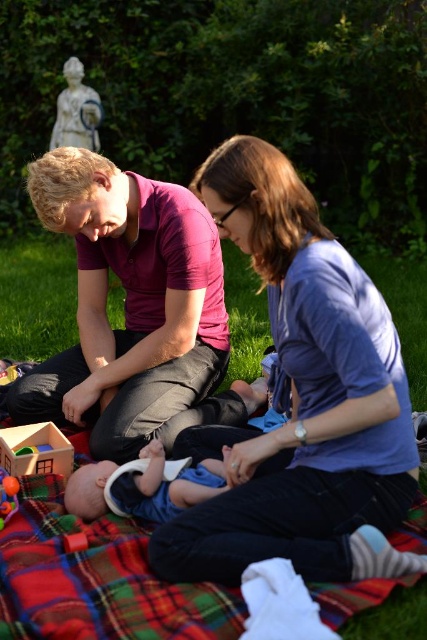
Is point (286, 445) more distant than point (8, 438)?

No, (286, 445) is in front of (8, 438).

Who is higher up, blue cotton shirt at center or wooden house at lower left?

blue cotton shirt at center is above.

This screenshot has width=427, height=640. Describe the element at coordinates (304, 397) in the screenshot. I see `blue cotton shirt at center` at that location.

Identify the location of blue cotton shirt at center. (304, 397).

Is white plastic bib at center to the left of wooden block at lower left from the viewer's perspective?

In fact, white plastic bib at center is to the right of wooden block at lower left.

Which of these two, white plastic bib at center or wooden block at lower left, stands shorter?

Standing shorter between the two is wooden block at lower left.

Describe the element at coordinates (143, 484) in the screenshot. Image resolution: width=427 pixels, height=640 pixels. I see `white plastic bib at center` at that location.

The image size is (427, 640). In order to click on white plastic bib at center in this screenshot , I will do `click(143, 484)`.

Is white plastic bib at center below rubberized plastic ball at center?

Incorrect, white plastic bib at center is not positioned below rubberized plastic ball at center.

Based on the photo, can you confirm if white plastic bib at center is positioned to the left of rubberized plastic ball at center?

Incorrect, white plastic bib at center is not on the left side of rubberized plastic ball at center.

What do you see at coordinates (143, 484) in the screenshot?
I see `white plastic bib at center` at bounding box center [143, 484].

Locate an element on the screen. This screenshot has width=427, height=640. white plastic bib at center is located at coordinates (143, 484).